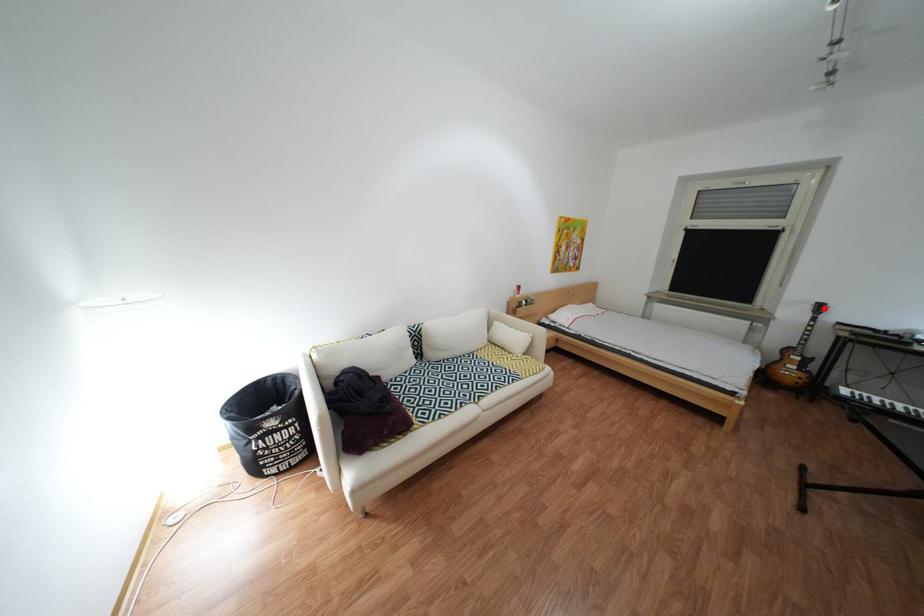
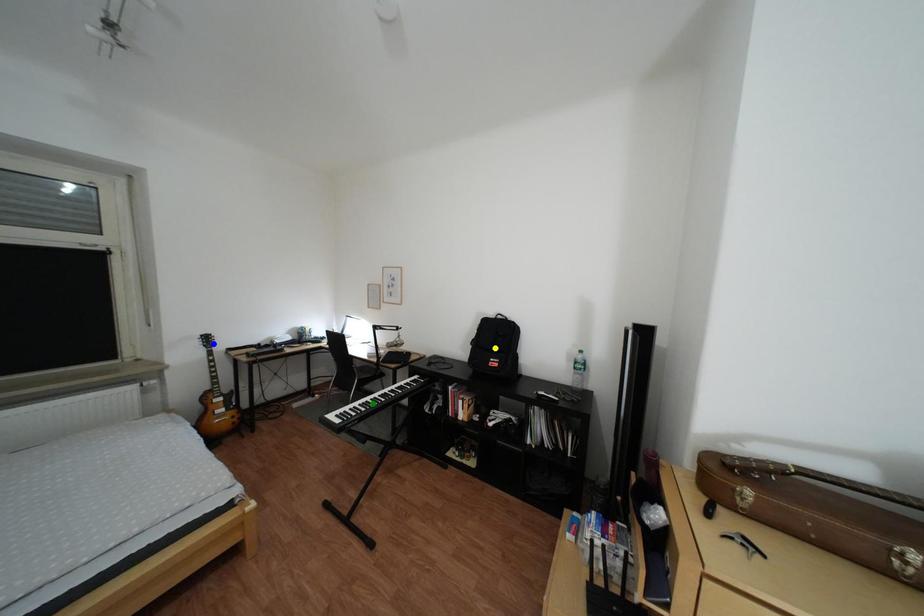
Question: I am providing you with two images of the same scene from different viewpoints. A red point is marked on the first image. You are given multiple points on the second image. Which spot in image 2 lines up with the point in image 1?

Choices:
 (A) yellow point
 (B) blue point
 (C) green point

Answer: (B)